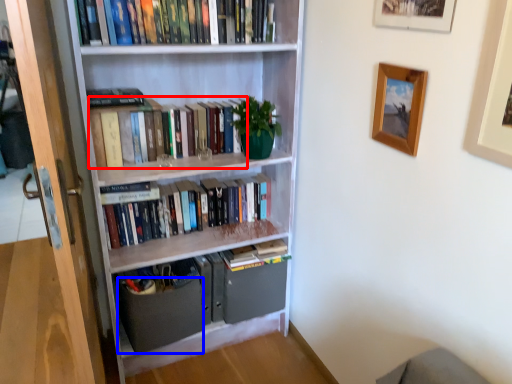
Question: Which point is further to the camera, book (highlighted by a red box) or drawer (highlighted by a blue box)?

Choices:
 (A) book
 (B) drawer

Answer: (B)